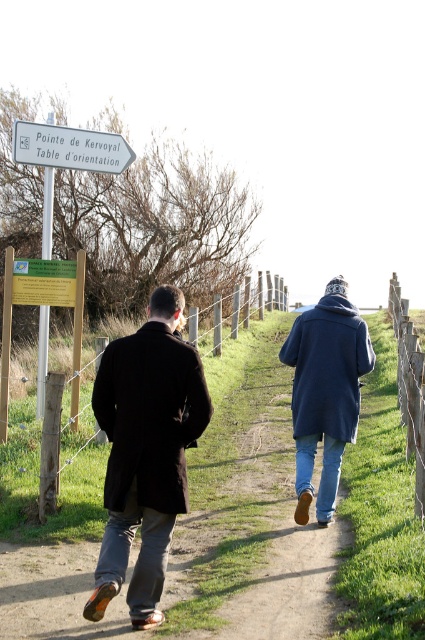
You are standing at the camera position and want to locate the dark wool coat at center. According to the coordinates given, in which direction relative to the camera should you look to find it?

The dark wool coat at center is located at coordinates point (325,392). Since the coordinate system typically places the origin at the bottom left corner, the x value of 0.614 indicates it is to the right of the center horizontally, and the y value of 0.765 means it is below the center vertically. Therefore, you should look to the right and downward from the center of the image to locate the dark wool coat at center.